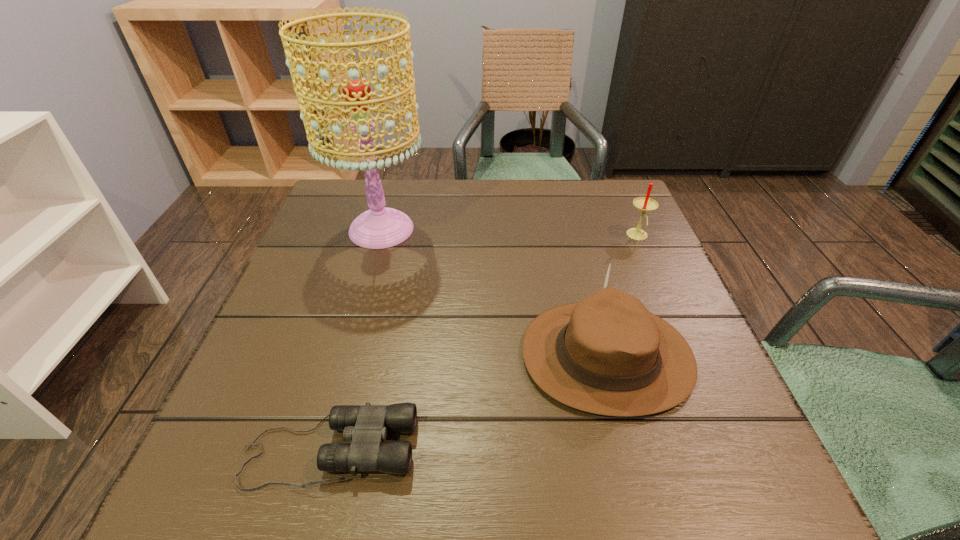
Find the location of a particular element. This screenshot has width=960, height=540. blank region between the binoculars and the fedora is located at coordinates (468, 403).

Locate which object is the second closest to the candle. Please provide its 2D coordinates. Your answer should be formatted as a tuple, i.e. [(x, y)], where the tuple contains the x and y coordinates of a point satisfying the conditions above.

[(380, 227)]

You are a GUI agent. You are given a task and a screenshot of the screen. Output one action in this format:
    pyautogui.click(x=<x>, y=<y>)
    Task: Click on the object that is the closest to the shortest object
    
    Given the screenshot: What is the action you would take?
    pyautogui.click(x=607, y=354)

Find the location of `free region that satisfies the following two spatial constraints: 1. on the front side of the candle; 2. at the eyepiece of the binoculars`. free region that satisfies the following two spatial constraints: 1. on the front side of the candle; 2. at the eyepiece of the binoculars is located at coordinates (732, 450).